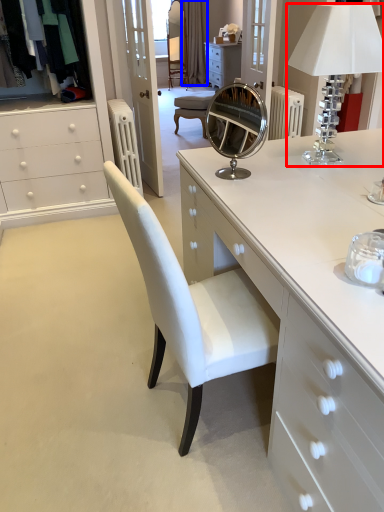
Question: Which of the following is the farthest to the observer, table lamp (highlighted by a red box) or curtain (highlighted by a blue box)?

Choices:
 (A) table lamp
 (B) curtain

Answer: (B)